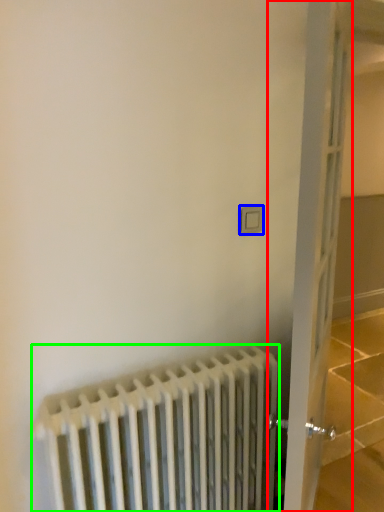
Question: Which is farther away from door (highlighted by a red box)? electric outlet (highlighted by a blue box) or radiator (highlighted by a green box)?

Choices:
 (A) electric outlet
 (B) radiator

Answer: (A)